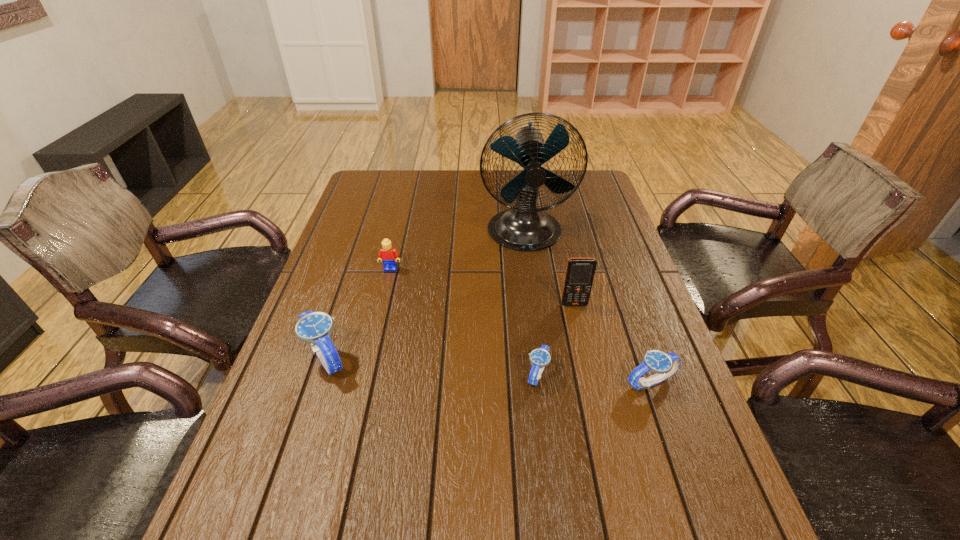
Locate an element on the screen. Image resolution: width=960 pixels, height=540 pixels. the leftmost object is located at coordinates (315, 328).

Locate an element on the screen. The image size is (960, 540). the tallest watch is located at coordinates (315, 328).

I want to click on the shortest watch, so click(540, 357).

Identify the location of the shortest object. (540, 357).

The width and height of the screenshot is (960, 540). I want to click on the second tallest watch, so click(664, 364).

Where is `the rightmost object`? This screenshot has height=540, width=960. the rightmost object is located at coordinates (664, 364).

Locate an element on the screen. fan is located at coordinates (525, 227).

Where is `the farthest object`? This screenshot has height=540, width=960. the farthest object is located at coordinates (525, 227).

At what (x,y) coordinates should I click in order to perform the action: click on the second tallest object. Please return your answer as a coordinate pair (x, y). The image size is (960, 540). Looking at the image, I should click on (580, 272).

Where is `cellular telephone`? The height and width of the screenshot is (540, 960). cellular telephone is located at coordinates (580, 272).